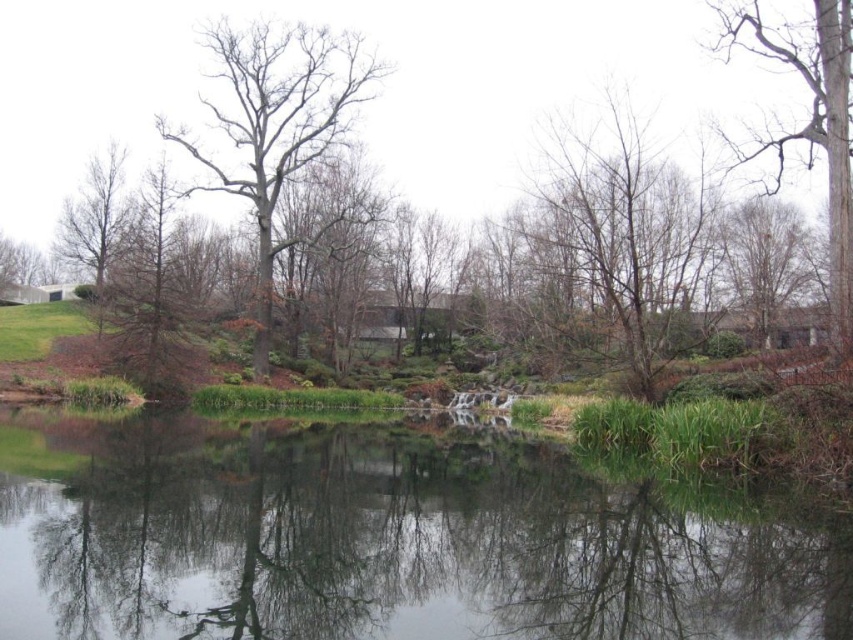
You are standing in the serene natural scene and want to walk towards both the bare wood tree at center and the brown textured tree at upper right. Which tree will you reach first?

You will reach the bare wood tree at center first because it is closer to you than the brown textured tree at upper right, which is further away.

You are standing at the edge of the water and want to take a photo of both point (x=341, y=58) and point (x=160, y=280). Which point will appear closer to the bottom of your camera screen?

Point (x=160, y=280) will appear closer to the bottom of your camera screen because it is closer to the camera than point (x=341, y=58).